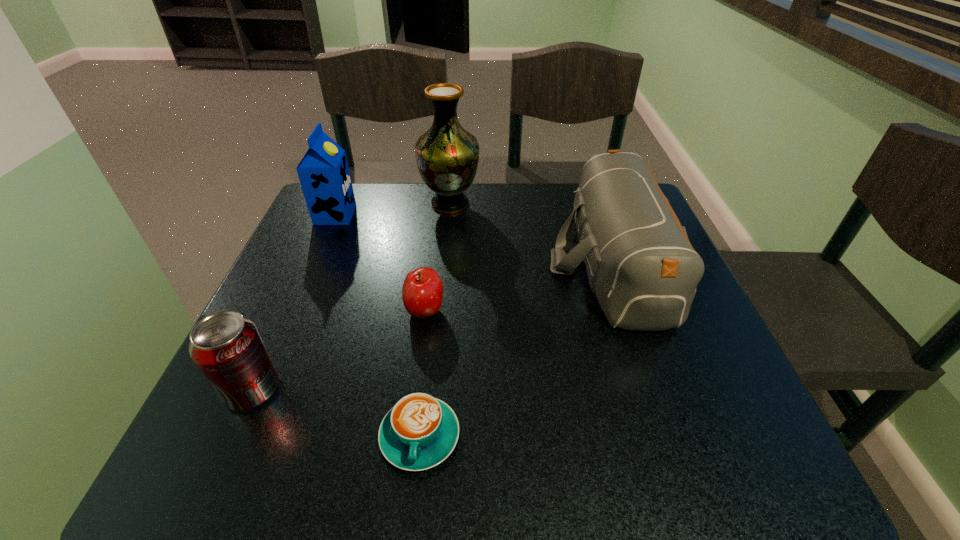
Locate an element on the screen. This screenshot has height=540, width=960. object at the far right corner is located at coordinates (640, 263).

Locate an element on the screen. free space at the far edge of the desktop is located at coordinates (408, 188).

Where is `vacant space at the left edge`? The width and height of the screenshot is (960, 540). vacant space at the left edge is located at coordinates (300, 287).

Identify the location of vacant area at the right edge of the desktop. This screenshot has width=960, height=540. (666, 418).

This screenshot has width=960, height=540. Identify the location of vacant space at the far left corner of the desktop. (358, 209).

This screenshot has height=540, width=960. I want to click on unoccupied position between the shortest object and the second shortest object, so click(422, 374).

In order to click on empty space between the fifth shortest object and the fifth tallest object in this screenshot , I will do `click(380, 263)`.

The image size is (960, 540). Find the location of `free space between the shortest object and the tallest object`. free space between the shortest object and the tallest object is located at coordinates (435, 320).

This screenshot has height=540, width=960. I want to click on unoccupied position between the fourth tallest object and the tallest object, so pyautogui.click(x=351, y=296).

The width and height of the screenshot is (960, 540). In order to click on unoccupied area between the third shortest object and the shortest object in this screenshot , I will do `click(336, 413)`.